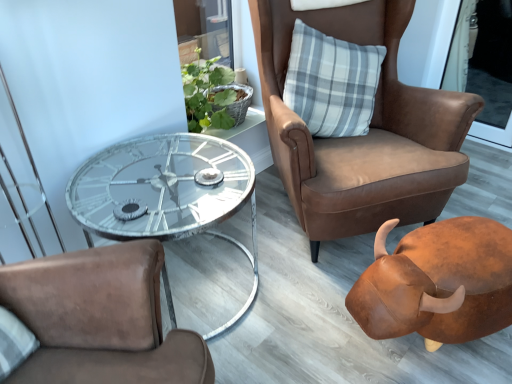
Question: Is brown leather chair at upper right thinner than brown leather piggy bank at lower right?

Choices:
 (A) no
 (B) yes

Answer: (A)

Question: Are brown leather chair at upper right and brown leather piggy bank at lower right far apart?

Choices:
 (A) yes
 (B) no

Answer: (B)

Question: Is brown leather chair at upper right looking in the opposite direction of brown leather piggy bank at lower right?

Choices:
 (A) yes
 (B) no

Answer: (B)

Question: Is brown leather chair at upper right not inside brown leather piggy bank at lower right?

Choices:
 (A) no
 (B) yes

Answer: (B)

Question: Is brown leather piggy bank at lower right a part of brown leather chair at upper right?

Choices:
 (A) no
 (B) yes

Answer: (A)

Question: Can you confirm if brown leather chair at upper right is positioned to the right of brown leather piggy bank at lower right?

Choices:
 (A) no
 (B) yes

Answer: (A)

Question: Is brown leather piggy bank at lower right positioned with its back to metallic glass coffee table at center?

Choices:
 (A) yes
 (B) no

Answer: (B)

Question: Does brown leather piggy bank at lower right have a lesser height compared to metallic glass coffee table at center?

Choices:
 (A) yes
 (B) no

Answer: (A)

Question: Is brown leather piggy bank at lower right not within metallic glass coffee table at center?

Choices:
 (A) no
 (B) yes

Answer: (B)

Question: Is brown leather piggy bank at lower right closer to camera compared to metallic glass coffee table at center?

Choices:
 (A) no
 (B) yes

Answer: (A)

Question: Considering the relative sizes of brown leather piggy bank at lower right and metallic glass coffee table at center in the image provided, is brown leather piggy bank at lower right thinner than metallic glass coffee table at center?

Choices:
 (A) yes
 (B) no

Answer: (B)

Question: From a real-world perspective, does brown leather piggy bank at lower right sit lower than metallic glass coffee table at center?

Choices:
 (A) no
 (B) yes

Answer: (B)

Question: Can you see gray plaid pillow at upper right touching metallic glass coffee table at center?

Choices:
 (A) yes
 (B) no

Answer: (B)